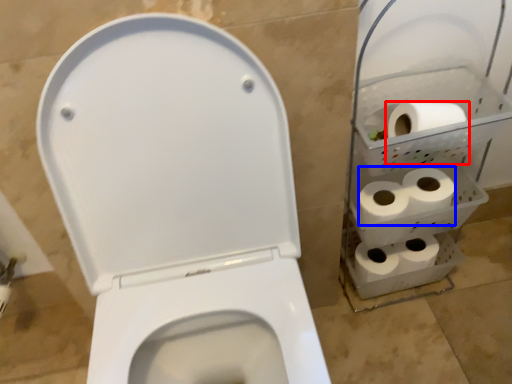
Question: Which object appears closest to the camera in this image, toilet paper (highlighted by a red box) or toilet paper (highlighted by a blue box)?

Choices:
 (A) toilet paper
 (B) toilet paper

Answer: (A)